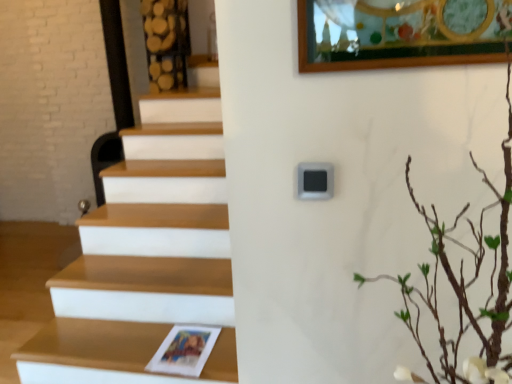
What do you see at coordinates (113, 353) in the screenshot? The width and height of the screenshot is (512, 384). I see `wooden at lower left` at bounding box center [113, 353].

Find the location of a particular element. The image size is (512, 384). wooden at lower left is located at coordinates (113, 353).

The image size is (512, 384). Describe the element at coordinates (465, 283) in the screenshot. I see `green leafy branches at upper right` at that location.

You are a GUI agent. You are given a task and a screenshot of the screen. Output one action in this format:
    pyautogui.click(x=<x>, y=<y>)
    Task: Click on the green leafy branches at upper right
    
    Given the screenshot: What is the action you would take?
    pyautogui.click(x=465, y=283)

What is the approximate width of green leafy branches at upper right?

It is 14.33 inches.

This screenshot has height=384, width=512. I want to click on wooden at lower left, so coord(113,353).

Between wooden at lower left and green leafy branches at upper right, which one appears on the right side from the viewer's perspective?

green leafy branches at upper right.

Does wooden at lower left come behind green leafy branches at upper right?

Yes.

Between point (110, 342) and point (356, 276), which one is positioned in front?

The point (356, 276) is in front.

From the image's perspective, is wooden at lower left positioned above or below green leafy branches at upper right?

Clearly, from the image's perspective, wooden at lower left is below green leafy branches at upper right.

From a real-world perspective, relative to green leafy branches at upper right, is wooden at lower left vertically above or below?

wooden at lower left is below green leafy branches at upper right.

Is wooden at lower left thinner than green leafy branches at upper right?

Indeed, wooden at lower left has a lesser width compared to green leafy branches at upper right.

Does wooden at lower left have a greater height compared to green leafy branches at upper right?

In fact, wooden at lower left may be shorter than green leafy branches at upper right.

Looking at this image, considering the relative sizes of wooden at lower left and green leafy branches at upper right in the image provided, is wooden at lower left bigger than green leafy branches at upper right?

No, wooden at lower left is not bigger than green leafy branches at upper right.

In the scene shown: Does wooden at lower left contain green leafy branches at upper right?

Definitely not — green leafy branches at upper right is not inside wooden at lower left.

Is wooden at lower left next to green leafy branches at upper right and touching it?

There is a gap between wooden at lower left and green leafy branches at upper right.

Is wooden at lower left oriented towards green leafy branches at upper right?

No, wooden at lower left does not turn towards green leafy branches at upper right.

What's the angular difference between wooden at lower left and green leafy branches at upper right's facing directions?

The angular difference between wooden at lower left and green leafy branches at upper right is 0.26 degrees.

Measure the distance between wooden at lower left and green leafy branches at upper right.

wooden at lower left and green leafy branches at upper right are 98.19 centimeters apart.

At what (x,y) coordinates should I click in order to perform the action: click on tree above the wooden at lower left (from the image's perspective). Please return your answer as a coordinate pair (x, y). This screenshot has height=384, width=512. Looking at the image, I should click on (465, 283).

Considering the relative positions of green leafy branches at upper right and wooden at lower left in the image provided, is green leafy branches at upper right to the left or to the right of wooden at lower left?

In the image, green leafy branches at upper right appears on the right side of wooden at lower left.

Which object is closer to the camera, green leafy branches at upper right or wooden at lower left?

green leafy branches at upper right is more forward.

Between point (508, 239) and point (134, 328), which one is positioned in front?

Point (508, 239)

From the image's perspective, is green leafy branches at upper right below wooden at lower left?

Incorrect, from the image's perspective, green leafy branches at upper right is higher than wooden at lower left.

From a real-world perspective, is green leafy branches at upper right located beneath wooden at lower left?

Actually, green leafy branches at upper right is physically above wooden at lower left in the real world.

Looking at their sizes, would you say green leafy branches at upper right is wider or thinner than wooden at lower left?

Clearly, green leafy branches at upper right has more width compared to wooden at lower left.

Considering the relative sizes of green leafy branches at upper right and wooden at lower left in the image provided, is green leafy branches at upper right taller than wooden at lower left?

Indeed, green leafy branches at upper right has a greater height compared to wooden at lower left.

Who is bigger, green leafy branches at upper right or wooden at lower left?

green leafy branches at upper right.

Is green leafy branches at upper right spatially inside wooden at lower left, or outside of it?

green leafy branches at upper right is located beyond the bounds of wooden at lower left.

Is the surface of green leafy branches at upper right in direct contact with wooden at lower left?

There is a gap between green leafy branches at upper right and wooden at lower left.

Does green leafy branches at upper right turn towards wooden at lower left?

No, green leafy branches at upper right is not turned towards wooden at lower left.

How many degrees apart are the facing directions of green leafy branches at upper right and wooden at lower left?

The angular difference between green leafy branches at upper right and wooden at lower left is 0.26 degrees.

You are a GUI agent. You are given a task and a screenshot of the screen. Output one action in this format:
    pyautogui.click(x=<x>, y=<y>)
    Task: Click on the tree in front of the wooden at lower left
    
    Given the screenshot: What is the action you would take?
    pyautogui.click(x=465, y=283)

The width and height of the screenshot is (512, 384). What are the coordinates of `shelf behind the green leafy branches at upper right` in the screenshot? It's located at (113, 353).

Locate an element on the screen. The width and height of the screenshot is (512, 384). shelf located on the left of green leafy branches at upper right is located at coordinates (113, 353).